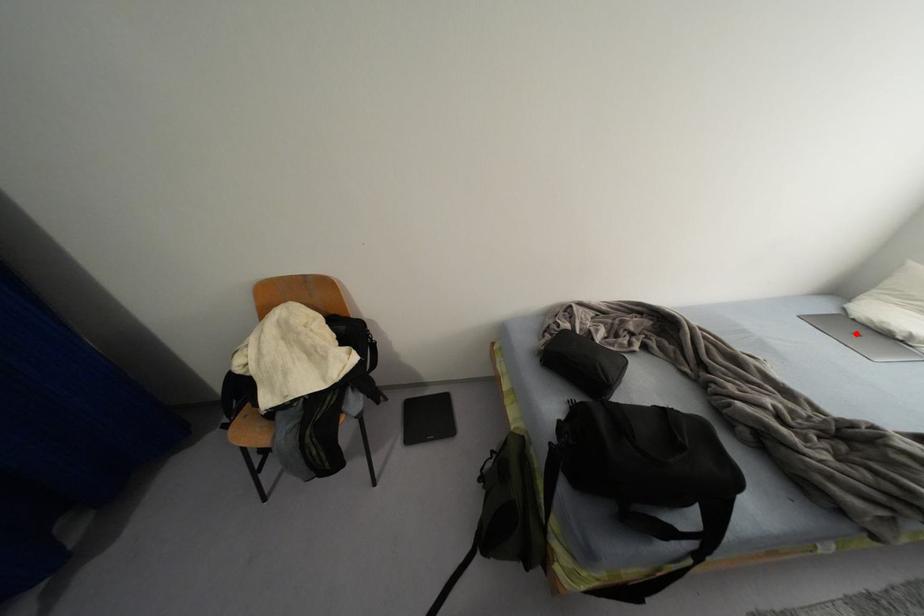
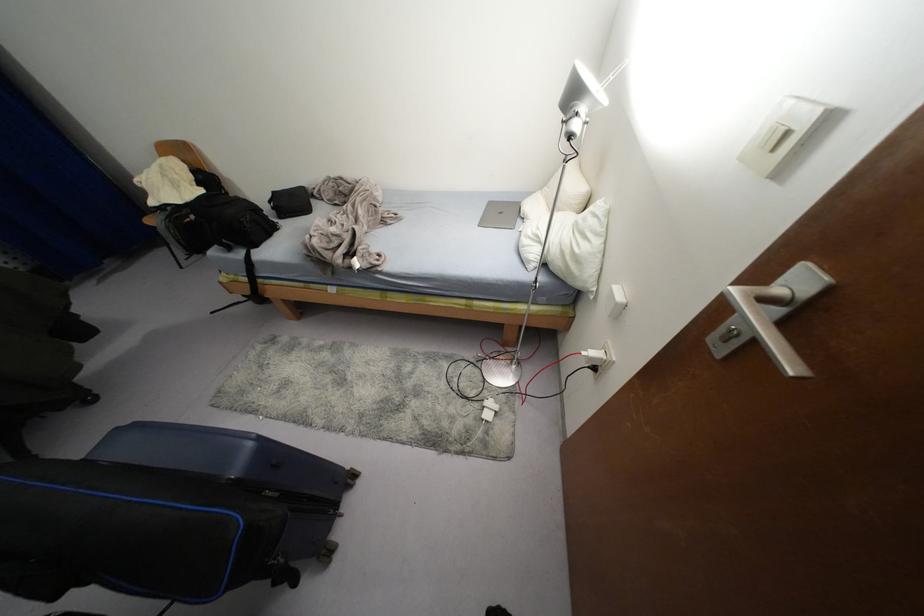
Question: I am providing you with two images of the same scene from different viewpoints. In image1, a red point is highlighted. Considering the same 3D point in image2, which of the following is correct?

Choices:
 (A) It is closer
 (B) It is farther

Answer: (A)